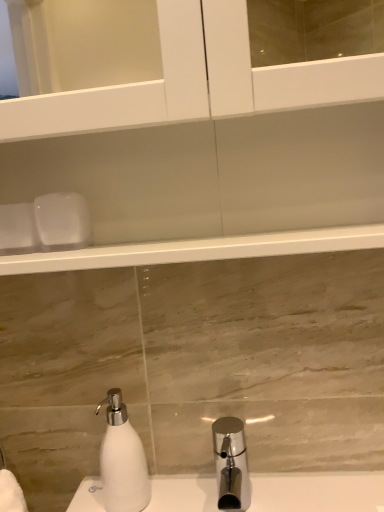
This screenshot has height=512, width=384. In order to click on white matte soap dispenser at lower left in this screenshot , I will do `click(122, 459)`.

This screenshot has height=512, width=384. What do you see at coordinates (122, 459) in the screenshot?
I see `white matte soap dispenser at lower left` at bounding box center [122, 459].

Image resolution: width=384 pixels, height=512 pixels. What do you see at coordinates (231, 463) in the screenshot?
I see `chrome metallic tap at lower center` at bounding box center [231, 463].

The height and width of the screenshot is (512, 384). In order to click on chrome metallic tap at lower center in this screenshot , I will do `click(231, 463)`.

Locate an element on the screen. This screenshot has height=512, width=384. white matte soap dispenser at lower left is located at coordinates (122, 459).

Would you say white matte soap dispenser at lower left is to the left or to the right of chrome metallic tap at lower center in the picture?

From the image, it's evident that white matte soap dispenser at lower left is to the left of chrome metallic tap at lower center.

Relative to chrome metallic tap at lower center, is white matte soap dispenser at lower left in front or behind?

In the image, white matte soap dispenser at lower left appears behind chrome metallic tap at lower center.

Is point (121, 449) closer or farther from the camera than point (243, 494)?

Point (121, 449) is closer to the camera than point (243, 494).

From the image's perspective, between white matte soap dispenser at lower left and chrome metallic tap at lower center, which one is located above?

white matte soap dispenser at lower left appears higher in the image.

From a real-world perspective, is white matte soap dispenser at lower left physically below chrome metallic tap at lower center?

Actually, white matte soap dispenser at lower left is physically above chrome metallic tap at lower center in the real world.

Considering the sizes of objects white matte soap dispenser at lower left and chrome metallic tap at lower center in the image provided, who is thinner, white matte soap dispenser at lower left or chrome metallic tap at lower center?

white matte soap dispenser at lower left.

Considering the sizes of objects white matte soap dispenser at lower left and chrome metallic tap at lower center in the image provided, who is taller, white matte soap dispenser at lower left or chrome metallic tap at lower center?

white matte soap dispenser at lower left.

Which of these two, white matte soap dispenser at lower left or chrome metallic tap at lower center, is smaller?

With smaller size is white matte soap dispenser at lower left.

Choose the correct answer: Is white matte soap dispenser at lower left inside chrome metallic tap at lower center or outside it?

white matte soap dispenser at lower left lies outside chrome metallic tap at lower center.

Is white matte soap dispenser at lower left not close to chrome metallic tap at lower center?

white matte soap dispenser at lower left is actually quite close to chrome metallic tap at lower center.

Is white matte soap dispenser at lower left facing towards chrome metallic tap at lower center?

No.

Image resolution: width=384 pixels, height=512 pixels. Find the location of `tap in front of the white matte soap dispenser at lower left`. tap in front of the white matte soap dispenser at lower left is located at coordinates (231, 463).

Would you say chrome metallic tap at lower center is to the left or to the right of white matte soap dispenser at lower left in the picture?

Based on their positions, chrome metallic tap at lower center is located to the right of white matte soap dispenser at lower left.

Is chrome metallic tap at lower center in front of or behind white matte soap dispenser at lower left in the image?

Visually, chrome metallic tap at lower center is located in front of white matte soap dispenser at lower left.

Considering the positions of point (224, 446) and point (116, 429), is point (224, 446) closer or farther from the camera than point (116, 429)?

Point (224, 446) is closer to the camera than point (116, 429).

From the image's perspective, between chrome metallic tap at lower center and white matte soap dispenser at lower left, which one is located above?

white matte soap dispenser at lower left is shown above in the image.

From a real-world perspective, is chrome metallic tap at lower center on white matte soap dispenser at lower left?

Incorrect, from a real-world perspective, chrome metallic tap at lower center is lower than white matte soap dispenser at lower left.

Which of these two, chrome metallic tap at lower center or white matte soap dispenser at lower left, is wider?

Wider between the two is chrome metallic tap at lower center.

Who is shorter, chrome metallic tap at lower center or white matte soap dispenser at lower left?

chrome metallic tap at lower center is shorter.

Between chrome metallic tap at lower center and white matte soap dispenser at lower left, which one has larger size?

chrome metallic tap at lower center is bigger.

Is chrome metallic tap at lower center positioned beyond the bounds of white matte soap dispenser at lower left?

Yes, chrome metallic tap at lower center is outside of white matte soap dispenser at lower left.

Is chrome metallic tap at lower center next to white matte soap dispenser at lower left?

There is a gap between chrome metallic tap at lower center and white matte soap dispenser at lower left.

Is chrome metallic tap at lower center looking in the opposite direction of white matte soap dispenser at lower left?

No, chrome metallic tap at lower center is not facing the opposite direction of white matte soap dispenser at lower left.

How much distance is there between chrome metallic tap at lower center and white matte soap dispenser at lower left?

chrome metallic tap at lower center and white matte soap dispenser at lower left are 5.89 inches apart from each other.

Locate an element on the screen. This screenshot has height=512, width=384. soap dispenser on the left side of chrome metallic tap at lower center is located at coordinates (122, 459).

Identify the location of tap in front of the white matte soap dispenser at lower left. Image resolution: width=384 pixels, height=512 pixels. (231, 463).

Where is `soap dispenser above the chrome metallic tap at lower center (from a real-world perspective)`? This screenshot has height=512, width=384. soap dispenser above the chrome metallic tap at lower center (from a real-world perspective) is located at coordinates (122, 459).